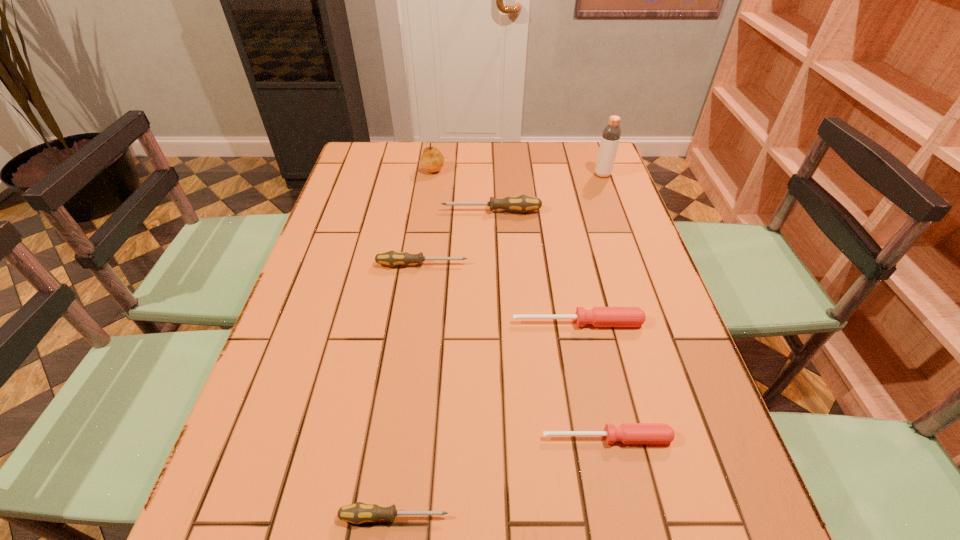
In the image, there is a desktop. Identify the location of vacant space at the far left corner. (393, 172).

Find the location of a particular element. This screenshot has width=960, height=540. vacant space at the far right corner of the desktop is located at coordinates (581, 170).

Locate an element on the screen. This screenshot has width=960, height=540. vacant area between the nearer red screwdriver and the tallest screwdriver is located at coordinates (549, 325).

Find the location of a particular element. The width and height of the screenshot is (960, 540). vacant point located between the rightmost object and the nearer red screwdriver is located at coordinates (605, 306).

In order to click on free space between the nearest gray screwdriver and the sixth shortest object in this screenshot , I will do `click(414, 342)`.

The image size is (960, 540). In order to click on free space between the farthest gray screwdriver and the nearest object in this screenshot , I will do `click(443, 364)`.

This screenshot has height=540, width=960. What are the coordinates of `vacant area that lies between the second farthest screwdriver and the second tallest object` in the screenshot? It's located at (428, 216).

The image size is (960, 540). I want to click on vacant point located between the third nearest screwdriver and the nearer red screwdriver, so click(x=592, y=380).

Select which object appears as the closest to the fifth shortest object. Please provide its 2D coordinates. Your answer should be formatted as a tuple, i.e. [(x, y)], where the tuple contains the x and y coordinates of a point satisfying the conditions above.

[(432, 160)]

Identify which object is the sixth nearest to the second nearest gray screwdriver. Please provide its 2D coordinates. Your answer should be formatted as a tuple, i.e. [(x, y)], where the tuple contains the x and y coordinates of a point satisfying the conditions above.

[(357, 513)]